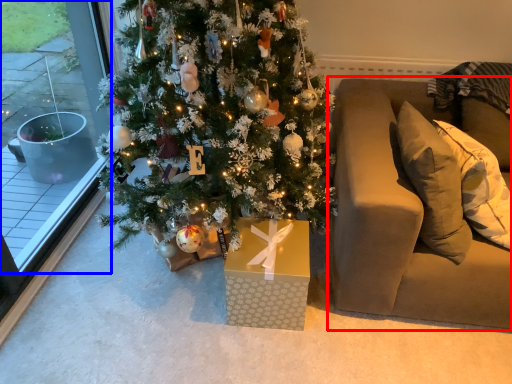
Question: Which point is closer to the camera, studio couch (highlighted by a red box) or window (highlighted by a blue box)?

Choices:
 (A) studio couch
 (B) window

Answer: (B)